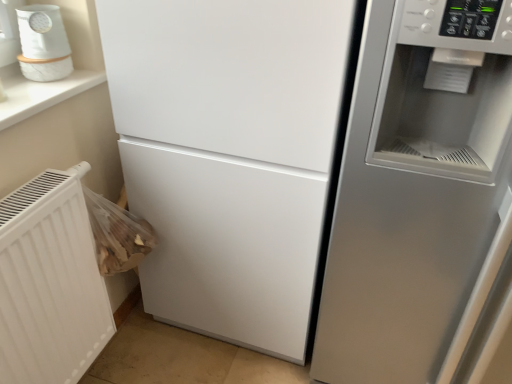
Question: From the image's perspective, is white textured radiator at lower left positioned above or below white glossy humidifier at upper left?

Choices:
 (A) below
 (B) above

Answer: (A)

Question: From their relative heights in the image, would you say white textured radiator at lower left is taller or shorter than white glossy humidifier at upper left?

Choices:
 (A) short
 (B) tall

Answer: (B)

Question: Considering the real-world distances, which object is closest to the satin silver fridge at right?

Choices:
 (A) white textured radiator at lower left
 (B) white glossy humidifier at upper left

Answer: (A)

Question: Which object is the closest to the white glossy humidifier at upper left?

Choices:
 (A) satin silver fridge at right
 (B) white textured radiator at lower left

Answer: (B)